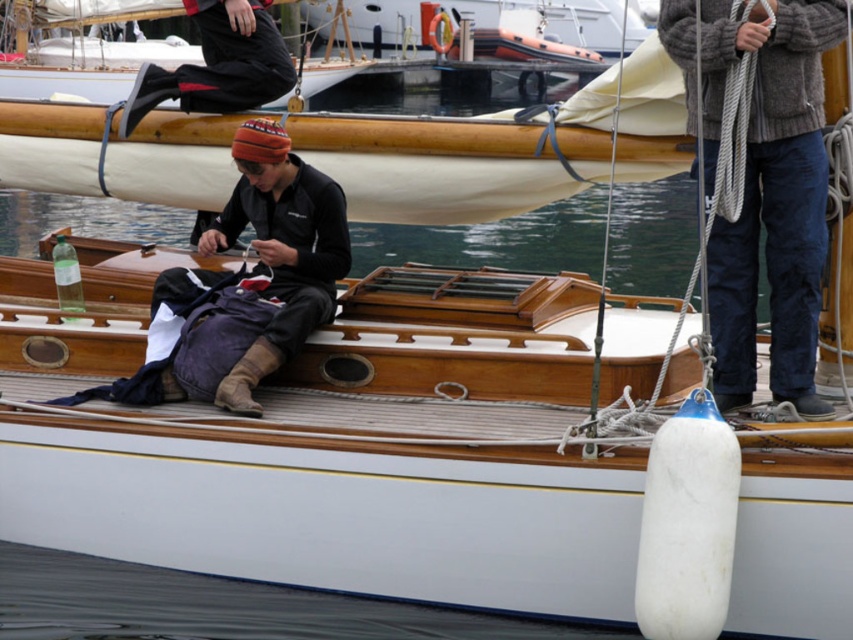
You are standing on the wooden deck of the sailboat and see two points marked on the deck. One is at point coordinates (782, 60) and the other at (332, 284). If you want to move from the first point to the second point, which direction should you move relative to the boat?

You should move towards the back of the boat because point (782, 60) is in front of point (332, 284), meaning the second point is located behind the first point on the boat.

You are a sailor trying to decide which item to place on the higher shelf in your cabin. The knitted wool sweater at upper right and the dark blue fabric backpack at center are both candidates. Based on their sizes, which one should you choose?

The knitted wool sweater at upper right has a greater height compared to the dark blue fabric backpack at center, so you should choose the knitted wool sweater at upper right for the higher shelf.

Looking at this image, you are standing at the edge of a boat dock and want to reach the knitted wool sweater at upper right. The dock is 50 feet long. Can you reach the sweater without stepping off the dock?

The knitted wool sweater at upper right is 60.61 feet away from you, which is beyond the 50 feet length of the dock. Therefore, you cannot reach it without stepping off the dock.